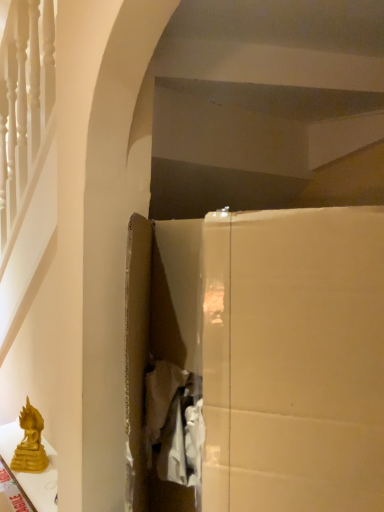
This screenshot has width=384, height=512. What do you see at coordinates (266, 354) in the screenshot?
I see `brown cardboard box at center` at bounding box center [266, 354].

Find the location of a particular element. Image resolution: width=384 pixels, height=512 pixels. brown cardboard box at center is located at coordinates (266, 354).

Locate an element on the screen. brown cardboard box at center is located at coordinates (266, 354).